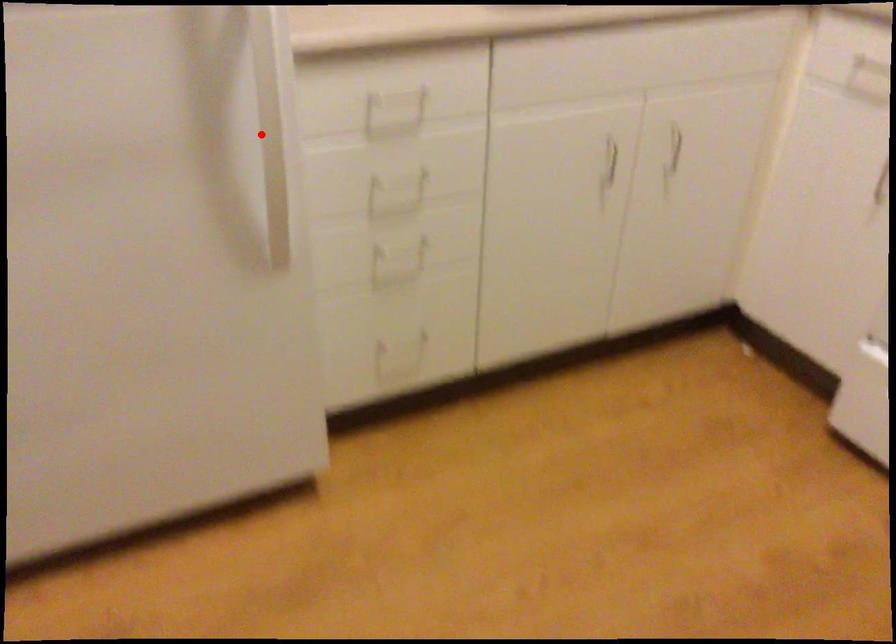
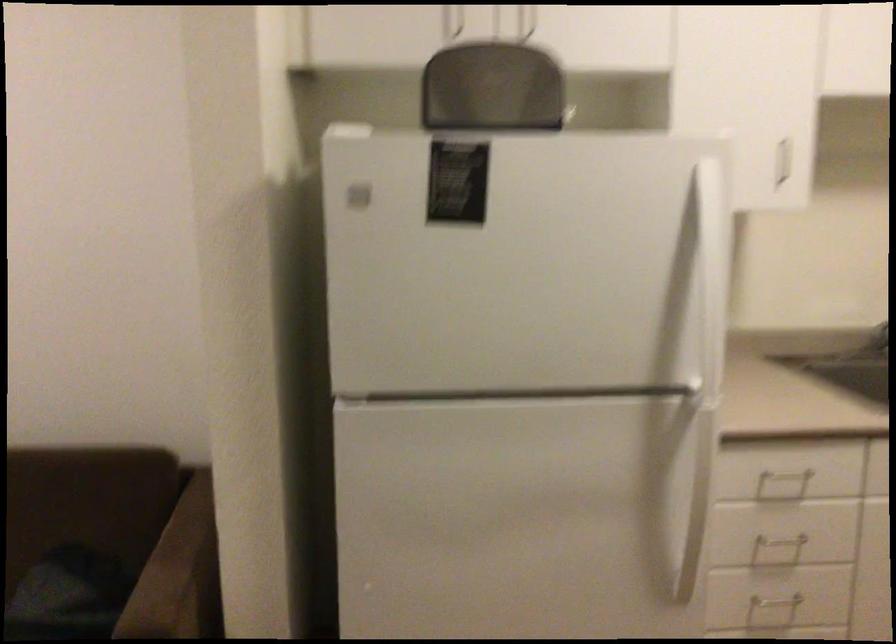
In the second image, find the point that corresponds to the highlighted location in the first image.

(687, 495)